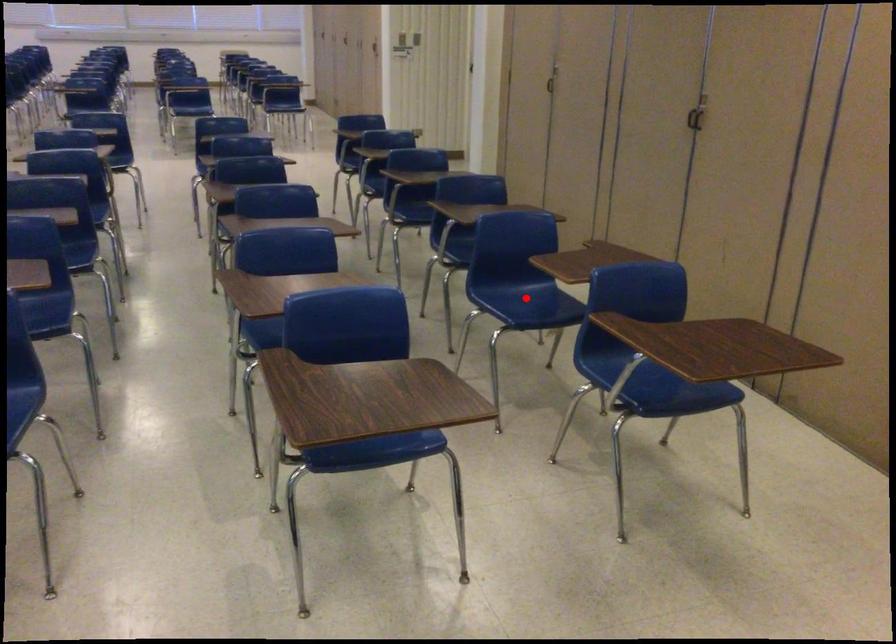
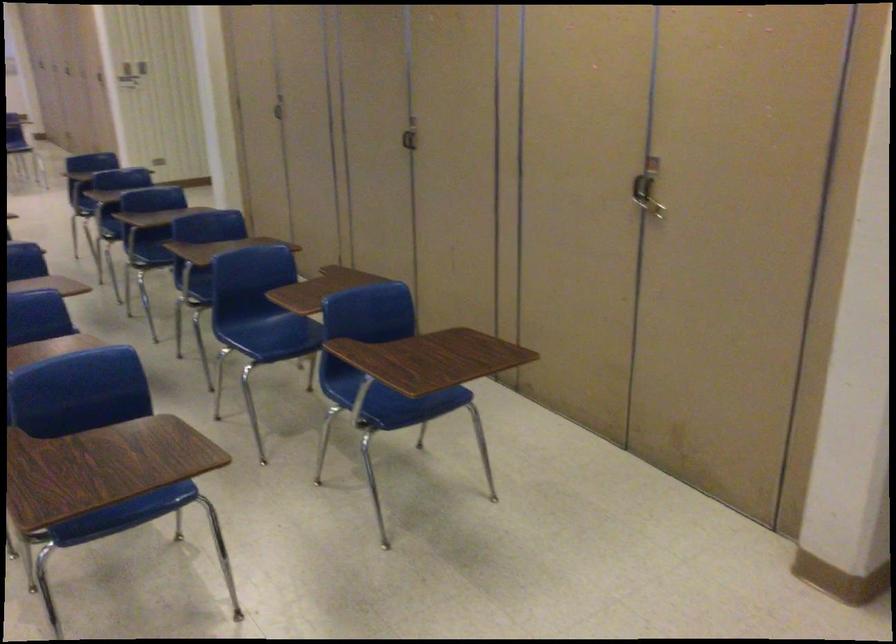
Where in the second image is the point corresponding to the highlighted location from the first image?

(272, 328)